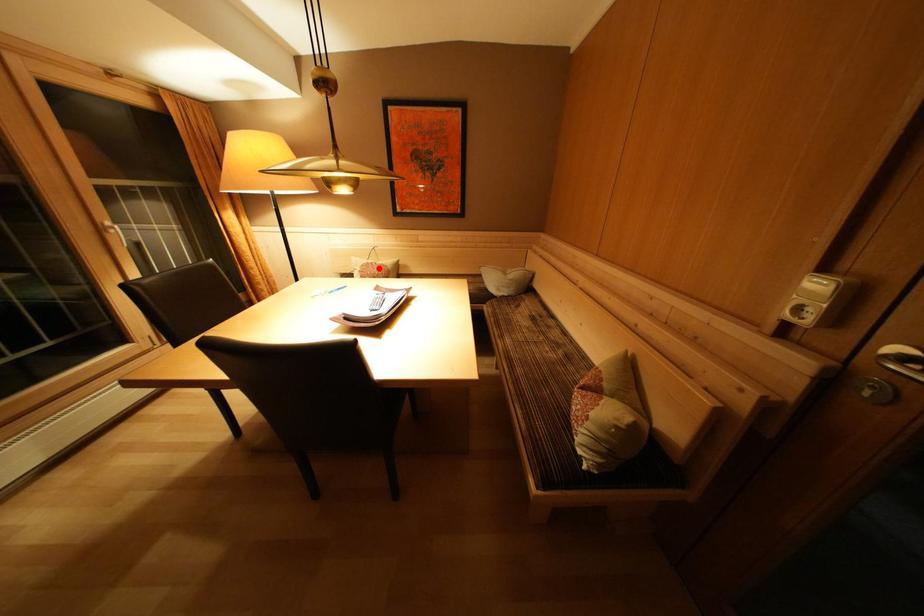
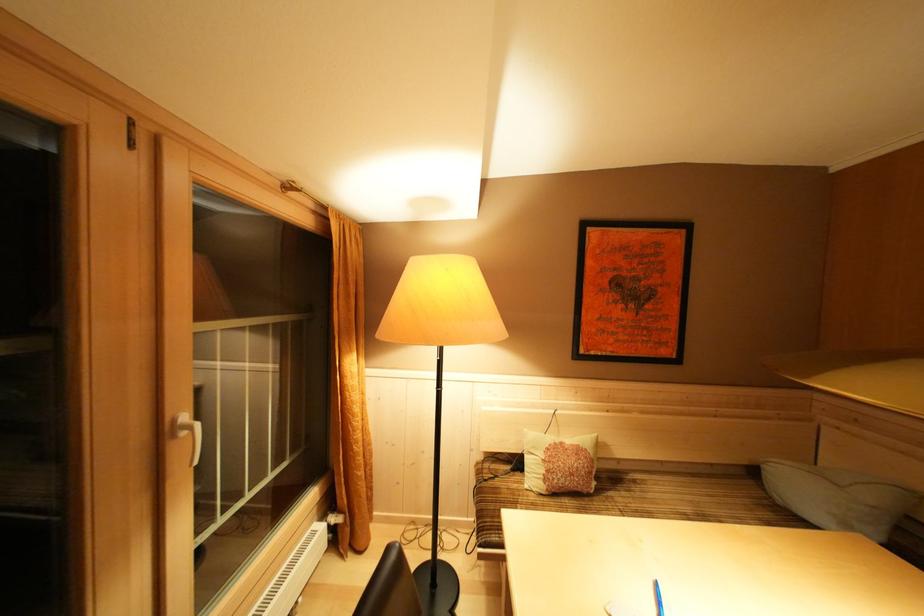
The point at the highlighted location is marked in the first image. Where is the corresponding point in the second image?

(568, 448)